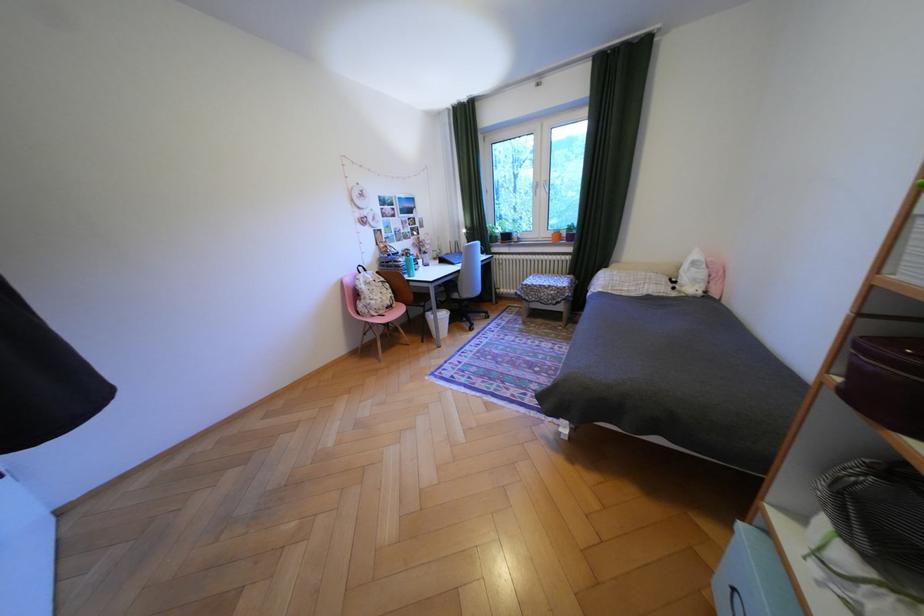
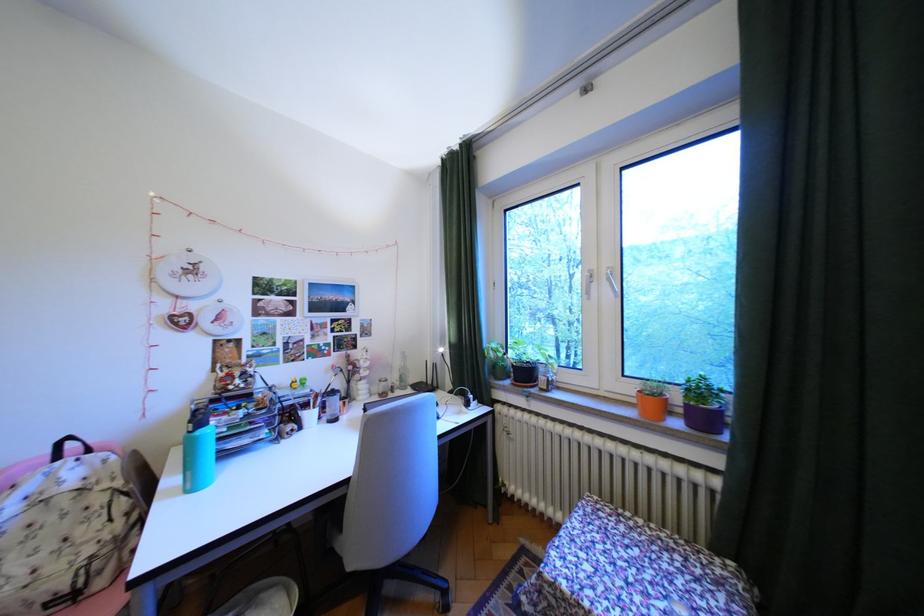
Where in the second image is the point corresponding to [562,233] from the first image?

(641, 390)